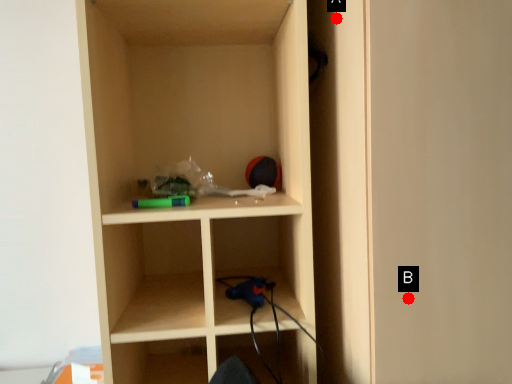
Question: Two points are circled on the image, labeled by A and B beside each circle. Which point is further to the camera?

Choices:
 (A) A is further
 (B) B is further

Answer: (A)